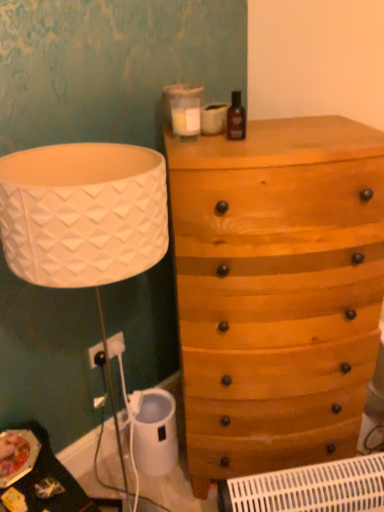
Question: In terms of width, does wooden chest of drawers at upper right look wider or thinner when compared to white plastic radiator at lower center?

Choices:
 (A) thin
 (B) wide

Answer: (B)

Question: From their relative heights in the image, would you say wooden chest of drawers at upper right is taller or shorter than white plastic radiator at lower center?

Choices:
 (A) short
 (B) tall

Answer: (B)

Question: Which object is positioned closest to the wooden chest of drawers at upper right?

Choices:
 (A) brown glass bottle at upper center
 (B) white plastic electric outlet at lower left
 (C) white plastic radiator at lower center

Answer: (C)

Question: Which object is the closest to the white plastic radiator at lower center?

Choices:
 (A) brown glass bottle at upper center
 (B) white plastic electric outlet at lower left
 (C) wooden chest of drawers at upper right

Answer: (C)